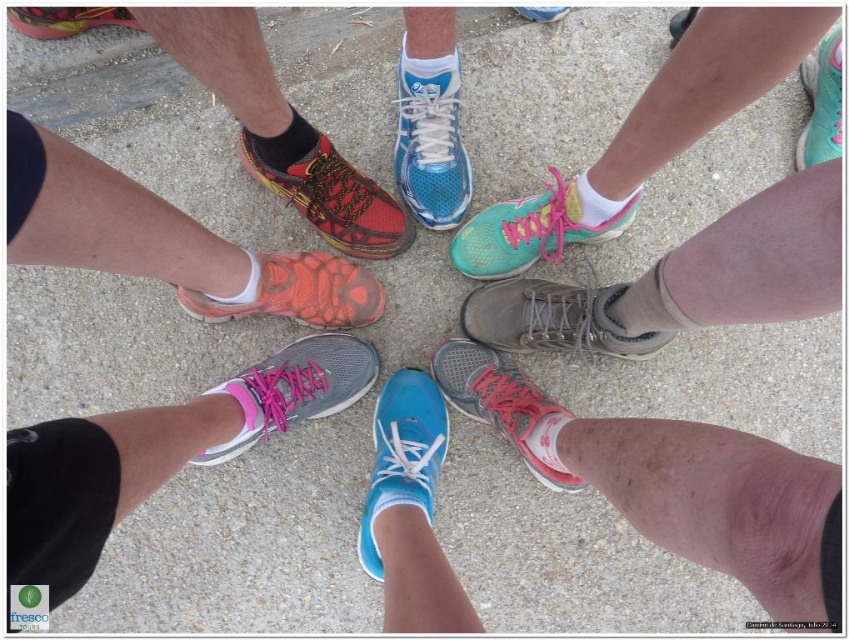
Question: Does matte orange shoe at left appear under shiny red running shoe at upper left?

Choices:
 (A) yes
 (B) no

Answer: (A)

Question: Does matte gray boot at center appear under teal mesh sneaker at center?

Choices:
 (A) yes
 (B) no

Answer: (A)

Question: Which object is the farthest from the gray mesh shoe at center?

Choices:
 (A) matte blue shoe at upper center
 (B) matte orange shoe at left

Answer: (A)

Question: Does matte blue sneaker at center have a larger size compared to shiny red running shoe at center?

Choices:
 (A) yes
 (B) no

Answer: (A)

Question: Which point is closer to the camera taking this photo?

Choices:
 (A) (437, 76)
 (B) (552, 13)
 (C) (571, 179)
 (D) (332, 259)

Answer: (A)

Question: Which object appears closest to the camera in this image?

Choices:
 (A) teal mesh sneaker at center
 (B) matte gray boot at center
 (C) matte blue sneaker at center

Answer: (B)